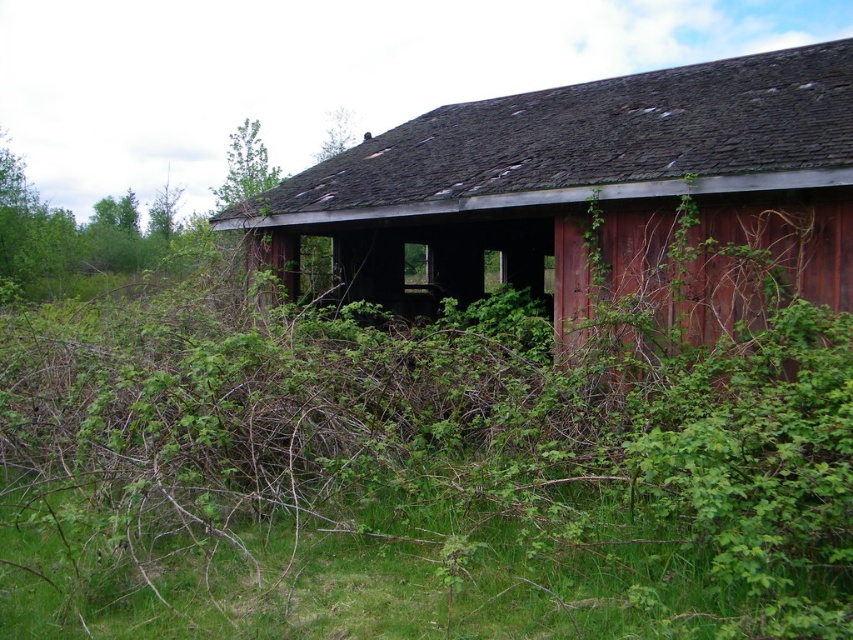
Question: In this image, where is green leafy bush at center located relative to green leafy tree at upper center?

Choices:
 (A) above
 (B) below

Answer: (B)

Question: Among these points, which one is nearest to the camera?

Choices:
 (A) (340, 147)
 (B) (9, 600)
 (C) (77, 600)

Answer: (C)

Question: Which object is closer to the camera taking this photo?

Choices:
 (A) green leafy tree at upper left
 (B) green leafy bush at center

Answer: (B)

Question: Does rusty wood barn at center appear under green grass at lower center?

Choices:
 (A) yes
 (B) no

Answer: (B)

Question: Does rusty wood barn at center have a greater width compared to green grass at lower center?

Choices:
 (A) no
 (B) yes

Answer: (B)

Question: Estimate the real-world distances between objects in this image. Which object is farther from the green leafy tree at left?

Choices:
 (A) green grass at lower center
 (B) green leafy tree at upper left

Answer: (A)